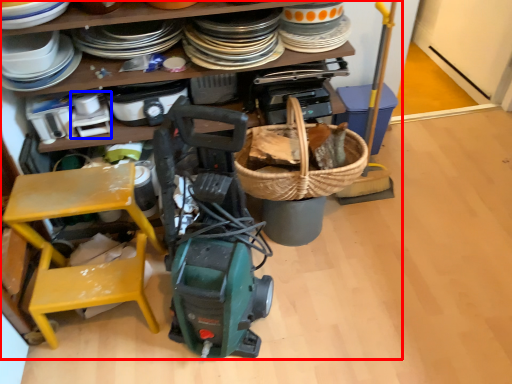
Question: Among these objects, which one is farthest to the camera, collection (highlighted by a red box) or appliance (highlighted by a blue box)?

Choices:
 (A) collection
 (B) appliance

Answer: (B)